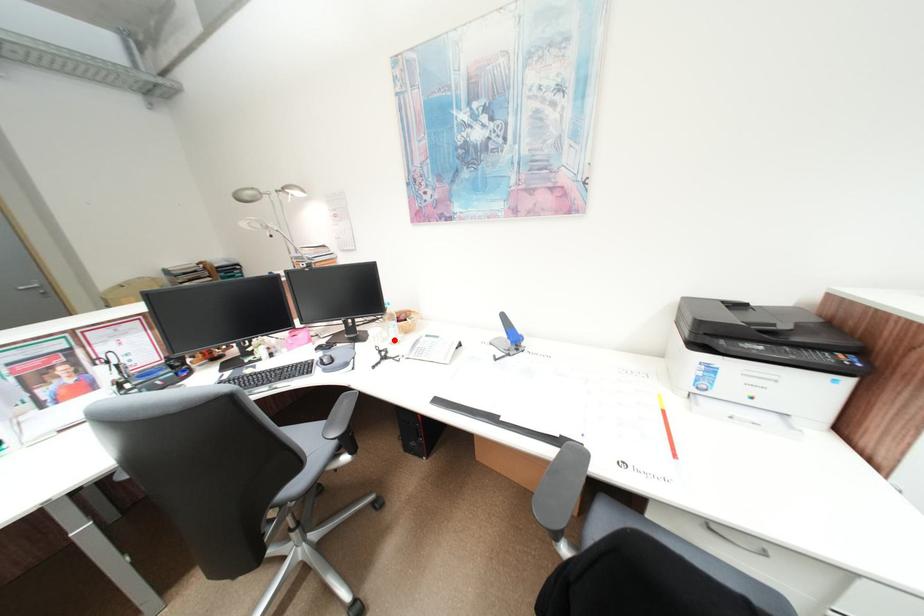
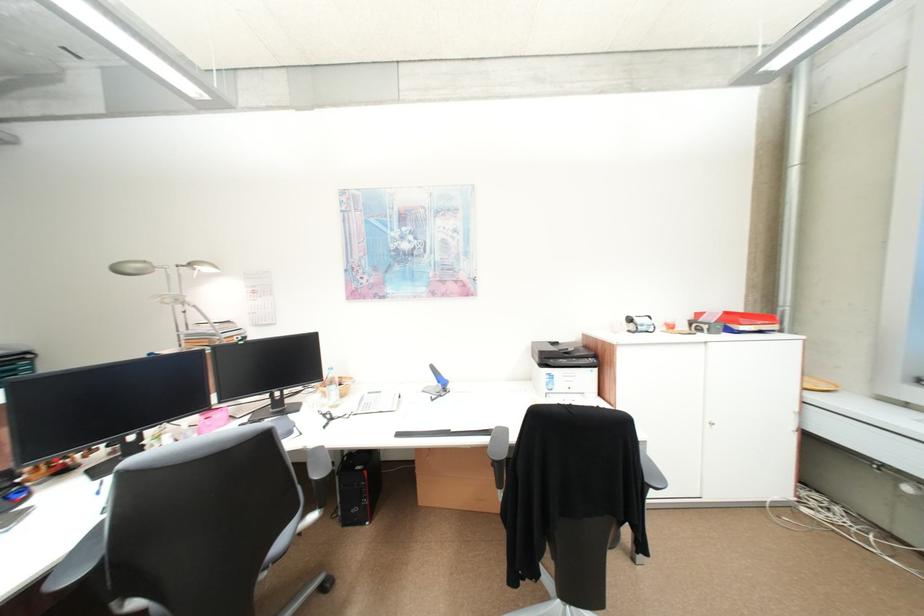
Where in the second image is the point corresponding to the highlighted location from the first image?

(332, 406)